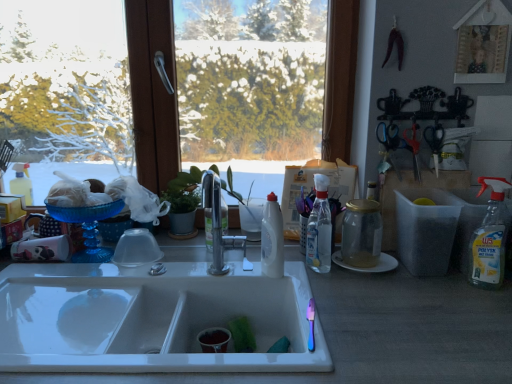
Question: Should I look upward or downward to see green leafy plant at center?

Choices:
 (A) down
 (B) up

Answer: (A)

Question: Considering the relative sizes of green leafy plant at center and transparent glass window at upper center in the image provided, is green leafy plant at center wider than transparent glass window at upper center?

Choices:
 (A) no
 (B) yes

Answer: (B)

Question: Is green leafy plant at center facing away from transparent glass window at upper center?

Choices:
 (A) no
 (B) yes

Answer: (B)

Question: Is green leafy plant at center thinner than transparent glass window at upper center?

Choices:
 (A) yes
 (B) no

Answer: (B)

Question: Is green leafy plant at center positioned far away from transparent glass window at upper center?

Choices:
 (A) yes
 (B) no

Answer: (B)

Question: Can you confirm if green leafy plant at center is shorter than transparent glass window at upper center?

Choices:
 (A) yes
 (B) no

Answer: (A)

Question: Is green leafy plant at center smaller than transparent glass window at upper center?

Choices:
 (A) no
 (B) yes

Answer: (B)

Question: Does metallic silver scissors at right, which ranks as the 2th scissors in left-to-right order, appear on the left side of white plastic bottle at center, which is the second bottle from right to left?

Choices:
 (A) no
 (B) yes

Answer: (A)

Question: From a real-world perspective, does metallic silver scissors at right, the first scissors viewed from the right, sit lower than white plastic bottle at center, the first bottle in the left-to-right sequence?

Choices:
 (A) no
 (B) yes

Answer: (A)

Question: Is metallic silver scissors at right, the first scissors viewed from the right, taller than white plastic bottle at center, which is the second bottle from right to left?

Choices:
 (A) yes
 (B) no

Answer: (B)

Question: From a real-world perspective, is metallic silver scissors at right, which ranks as the 2th scissors in left-to-right order, positioned over white plastic bottle at center, which is the second bottle from right to left, based on gravity?

Choices:
 (A) no
 (B) yes

Answer: (B)

Question: Could you tell me if metallic silver scissors at right, the first scissors viewed from the right, is turned towards white plastic bottle at center, which is the second bottle from right to left?

Choices:
 (A) yes
 (B) no

Answer: (B)

Question: Considering the relative sizes of metallic silver scissors at right, the first scissors viewed from the right, and white plastic bottle at center, which is the second bottle from right to left, in the image provided, is metallic silver scissors at right, the first scissors viewed from the right, bigger than white plastic bottle at center, which is the second bottle from right to left,?

Choices:
 (A) yes
 (B) no

Answer: (B)

Question: Are clear glass bottle at center, the 2th bottle positioned from the left, and blue plastic scissors at upper right, arranged as the second scissors when viewed from the right, far apart?

Choices:
 (A) yes
 (B) no

Answer: (B)